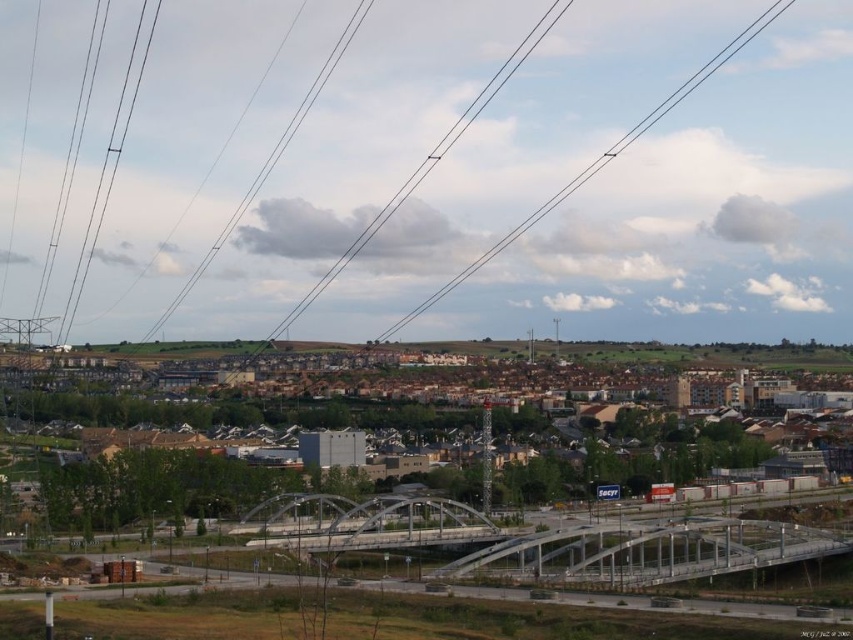
You are a drone operator tasked with capturing aerial footage of the suburban area. Your drone is currently positioned above the brown brick buildings at center and needs to fly towards the metallic gray bridge at center. According to the image, will the drone have an unobstructed path to the bridge?

The metallic gray bridge at center is behind the brown brick buildings at center, so the drone will not have an unobstructed path to the bridge as the buildings are blocking the way.

You are a drone operator planning to fly a drone over the suburban area shown in the image. The drone has a maximum flight height of 10 meters. Considering the black wire at upper center and the metallic gray bridge at center, which object would the drone need to avoid due to its height?

The black wire at upper center is much taller than the metallic gray bridge at center, so the drone would need to avoid the black wire at upper center to stay within its maximum flight height of 10 meters.